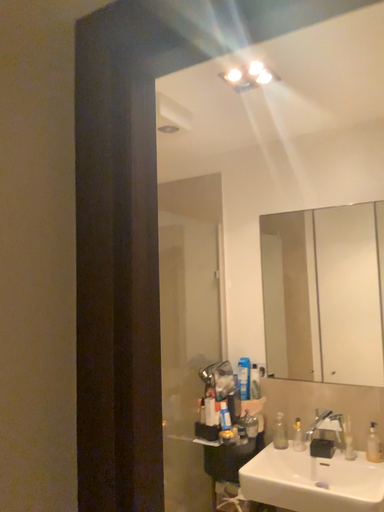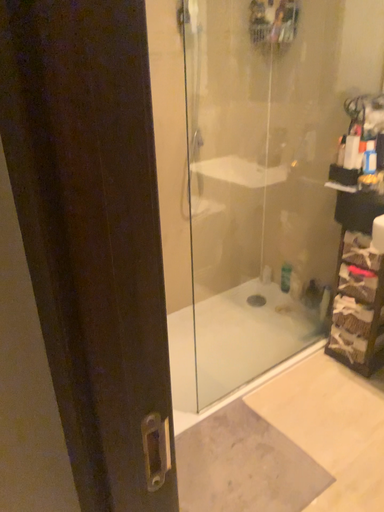
Question: How did the camera likely rotate when shooting the video?

Choices:
 (A) rotated upward
 (B) rotated downward

Answer: (B)